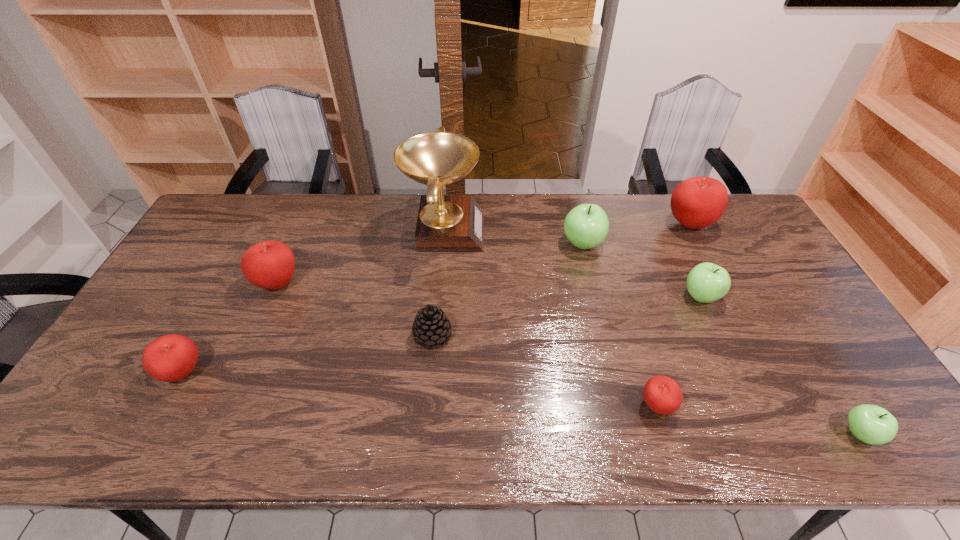
Identify the location of award. (446, 223).

The width and height of the screenshot is (960, 540). What are the coordinates of `the eighth shortest object` in the screenshot? It's located at [697, 202].

Image resolution: width=960 pixels, height=540 pixels. Identify the location of the rightmost red apple. (697, 202).

Find the location of a particular element. Image resolution: width=960 pixels, height=540 pixels. the biggest green apple is located at coordinates (586, 226).

Find the location of `the farthest green apple`. the farthest green apple is located at coordinates (586, 226).

Locate an element on the screen. the third red apple from right to left is located at coordinates (270, 264).

Locate an element on the screen. the second farthest red apple is located at coordinates (270, 264).

Find the location of a particular element. the leftmost object is located at coordinates 169,358.

Find the location of a particular element. The image size is (960, 540). the leftmost apple is located at coordinates (169, 358).

This screenshot has height=540, width=960. I want to click on the second smallest green apple, so click(x=707, y=282).